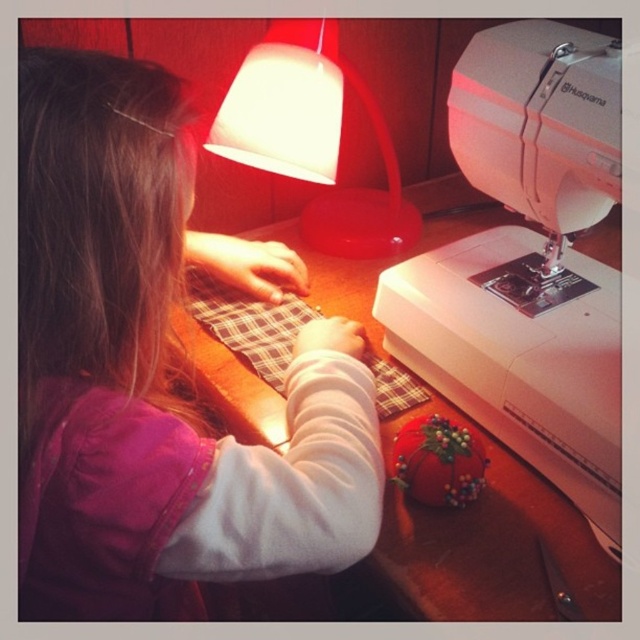
Is pink fleece sweater at upper left thinner than matte plastic lamp at upper center?

Yes.

Which is in front, point (28, 204) or point (388, 189)?

Point (28, 204)

In order to click on pink fleece sweater at upper left in this screenshot , I will do `click(156, 371)`.

The image size is (640, 640). What do you see at coordinates (529, 262) in the screenshot?
I see `white plastic sewing machine at right` at bounding box center [529, 262].

Which is in front, point (458, 132) or point (227, 422)?

Point (458, 132)

The width and height of the screenshot is (640, 640). I want to click on white plastic sewing machine at right, so click(529, 262).

Does white plastic sewing machine at right come in front of matte plastic lamp at upper center?

Yes, white plastic sewing machine at right is closer to the viewer.

Is point (598, 419) positioned before point (241, 147)?

Yes, point (598, 419) is in front of point (241, 147).

Image resolution: width=640 pixels, height=640 pixels. Find the location of `white plastic sewing machine at right`. white plastic sewing machine at right is located at coordinates (529, 262).